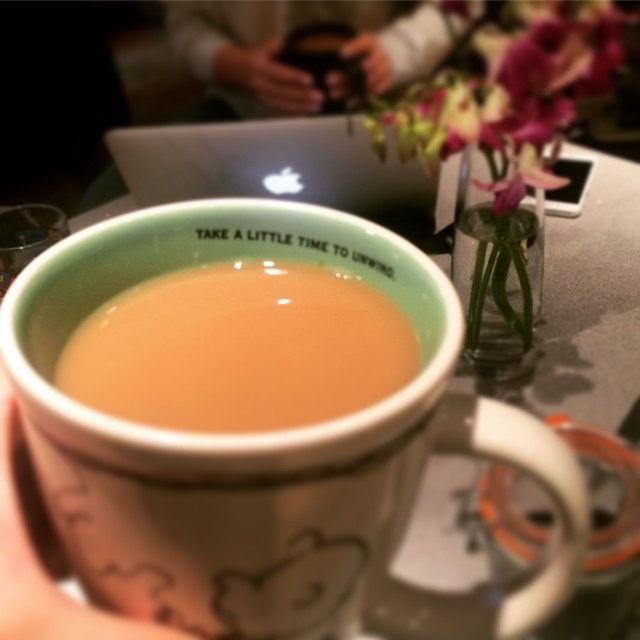
From the picture: You are organizing items on a desk and need to place the smooth leather wallet at upper center and the white matte cup at center. If you want to ensure both items are visible to someone sitting across from you, which item should you move closer to the edge of the desk?

The smooth leather wallet at upper center is already closer to the viewer than the white matte cup at center, so you should move the white matte cup at center closer to the edge of the desk to make it more visible.

Consider the image. You are a delivery robot that needs to place a small package between the smooth leather wallet at upper center and the white matte cup at center. The package is 18 inches long. Can you fit it between them?

The smooth leather wallet at upper center and the white matte cup at center are 17.90 inches apart from each other. Since the package is 18 inches long, it cannot fit between them as there is not enough space.

You are a barista preparing a drink and need to place the purple silk flower at upper right and the white matte cup at center on a shelf. The shelf has limited vertical space. Based on the scene, which object might not fit vertically due to its height?

The purple silk flower at upper right is much taller than the white matte cup at center, so it might not fit vertically on the shelf with limited space.